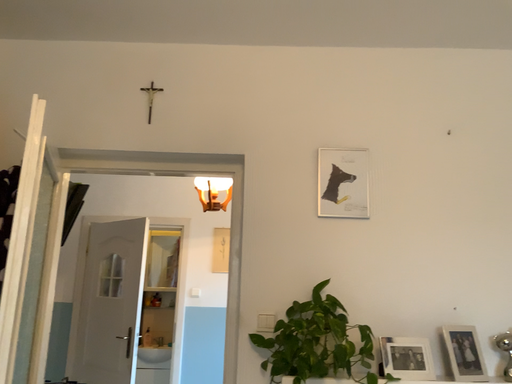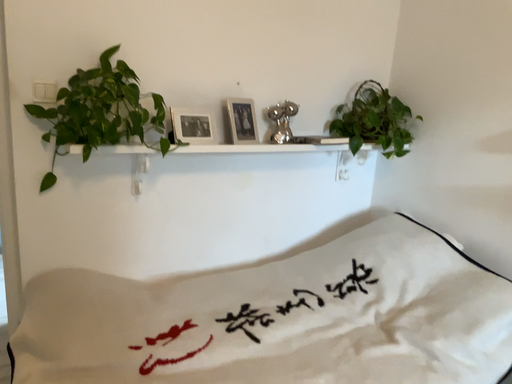
Question: Which way did the camera rotate in the video?

Choices:
 (A) rotated left
 (B) rotated right

Answer: (B)